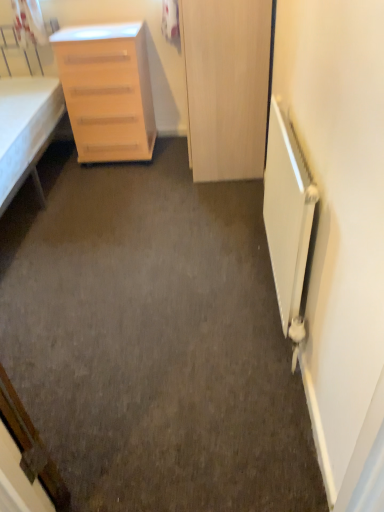
Question: Is point (251, 83) closer or farther from the camera than point (26, 175)?

Choices:
 (A) farther
 (B) closer

Answer: (B)

Question: Based on their sizes in the image, would you say wooden door at center is bigger or smaller than white fabric bed at left?

Choices:
 (A) big
 (B) small

Answer: (B)

Question: Based on their relative distances, which object is farther from the wooden door at center?

Choices:
 (A) light wood/finely finished chest of drawers at left
 (B) white matte radiator at right
 (C) white fabric bed at left

Answer: (C)

Question: Considering the real-world distances, which object is closest to the light wood/finely finished chest of drawers at left?

Choices:
 (A) white matte radiator at right
 (B) wooden door at center
 (C) white fabric bed at left

Answer: (C)